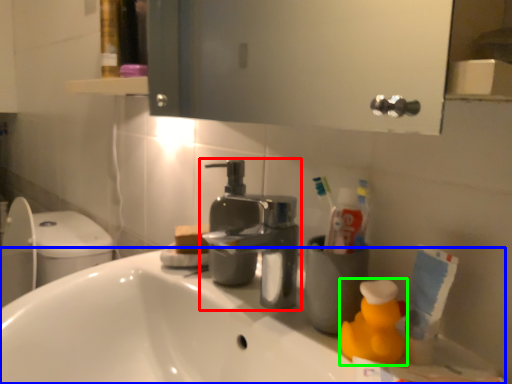
Question: Based on their relative distances, which object is nearer to tap (highlighted by a red box)? Choose from counter top (highlighted by a blue box) and cleaning product (highlighted by a green box).

Choices:
 (A) counter top
 (B) cleaning product

Answer: (A)